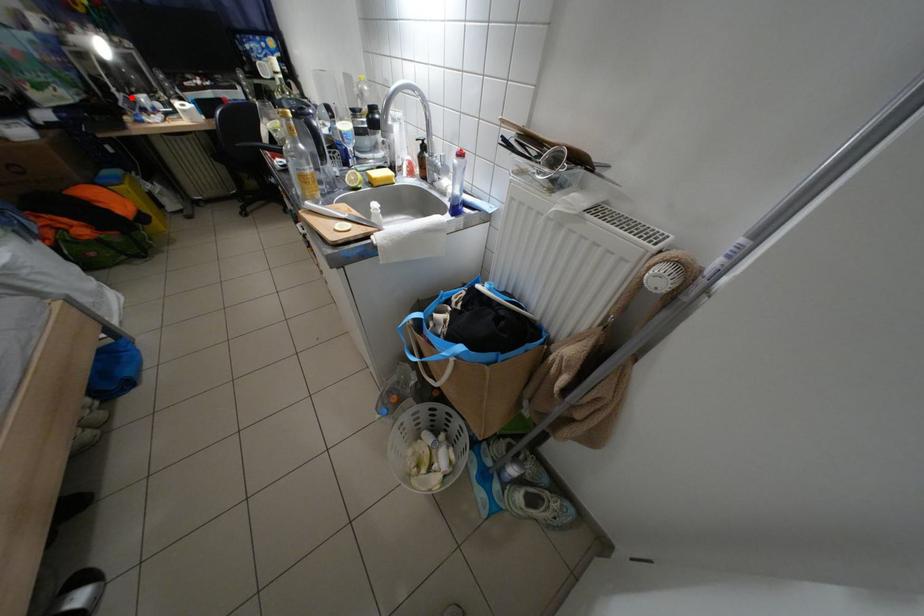
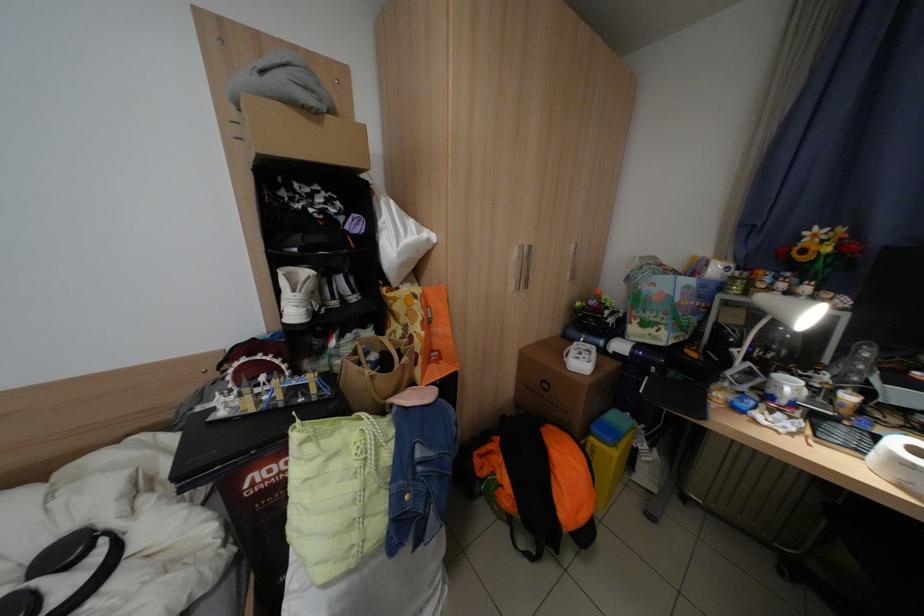
Where in the second image is the point corresponding to the highlighted location from the first image?

(752, 366)